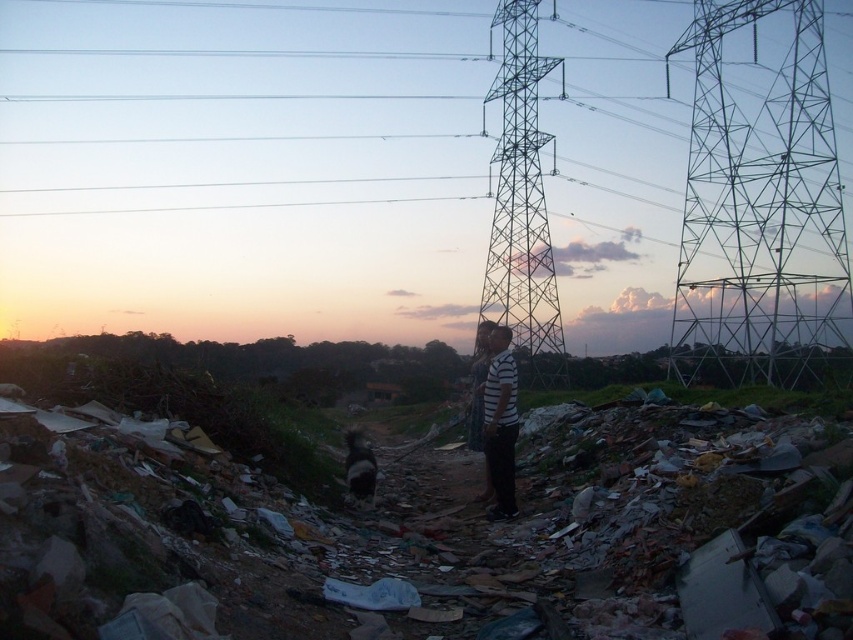
Based on the photo, between metallic grid structure at upper right and white striped shirt at center, which one has more height?

metallic grid structure at upper right is taller.

Looking at this image, does metallic grid structure at upper right have a lesser height compared to white striped shirt at center?

No, metallic grid structure at upper right is not shorter than white striped shirt at center.

Between point (788, 314) and point (509, 356), which one is positioned in front?

Point (509, 356) is more forward.

At what (x,y) coordinates should I click in order to perform the action: click on metallic grid structure at upper right. Please return your answer as a coordinate pair (x, y). Looking at the image, I should click on (761, 214).

Is metallic grid structure at upper right further to camera compared to metallic structure at center?

No, metallic grid structure at upper right is in front of metallic structure at center.

Is metallic grid structure at upper right wider than metallic structure at center?

Correct, the width of metallic grid structure at upper right exceeds that of metallic structure at center.

Locate an element on the screen. Image resolution: width=853 pixels, height=640 pixels. metallic grid structure at upper right is located at coordinates (761, 214).

Locate an element on the screen. The width and height of the screenshot is (853, 640). metallic grid structure at upper right is located at coordinates (761, 214).

Does metallic structure at center have a greater width compared to white striped shirt at center?

Correct, the width of metallic structure at center exceeds that of white striped shirt at center.

Which of these two, metallic structure at center or white striped shirt at center, stands taller?

Standing taller between the two is metallic structure at center.

At what (x,y) coordinates should I click in order to perform the action: click on metallic structure at center. Please return your answer as a coordinate pair (x, y). The image size is (853, 640). Looking at the image, I should click on (521, 204).

Where is `metallic structure at center`? The width and height of the screenshot is (853, 640). metallic structure at center is located at coordinates (521, 204).